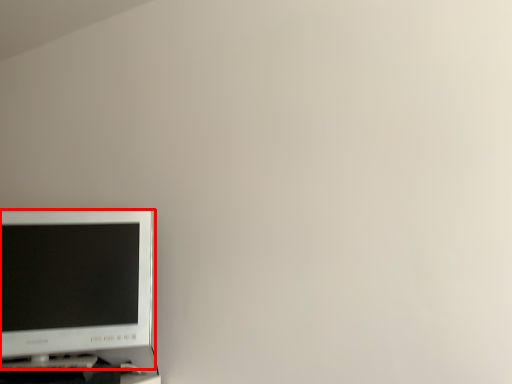
Question: In this image, where is computer monitor (annotated by the red box) located relative to computer desk?

Choices:
 (A) left
 (B) right

Answer: (B)